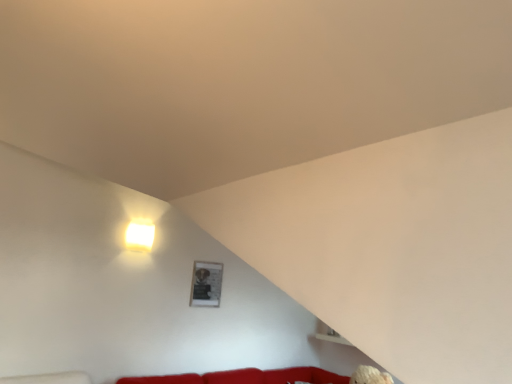
Question: Is white glossy square at upper left in front of matte black picture frame at upper center?

Choices:
 (A) yes
 (B) no

Answer: (A)

Question: Is matte black picture frame at upper center surrounded by white glossy square at upper left?

Choices:
 (A) yes
 (B) no

Answer: (B)

Question: From the image's perspective, does white glossy square at upper left appear lower than matte black picture frame at upper center?

Choices:
 (A) no
 (B) yes

Answer: (A)

Question: Can you confirm if white glossy square at upper left is taller than matte black picture frame at upper center?

Choices:
 (A) no
 (B) yes

Answer: (A)

Question: Is white glossy square at upper left to the left of matte black picture frame at upper center from the viewer's perspective?

Choices:
 (A) no
 (B) yes

Answer: (B)

Question: From a real-world perspective, is white glossy square at upper left below matte black picture frame at upper center?

Choices:
 (A) no
 (B) yes

Answer: (A)

Question: Does matte black picture frame at upper center turn towards white glossy square at upper left?

Choices:
 (A) no
 (B) yes

Answer: (A)

Question: From the image's perspective, is matte black picture frame at upper center below white glossy square at upper left?

Choices:
 (A) no
 (B) yes

Answer: (B)

Question: Can you confirm if matte black picture frame at upper center is taller than white glossy square at upper left?

Choices:
 (A) no
 (B) yes

Answer: (B)

Question: Is matte black picture frame at upper center to the right of white glossy square at upper left from the viewer's perspective?

Choices:
 (A) no
 (B) yes

Answer: (B)

Question: Does matte black picture frame at upper center contain white glossy square at upper left?

Choices:
 (A) no
 (B) yes

Answer: (A)

Question: Can you confirm if matte black picture frame at upper center is shorter than white glossy square at upper left?

Choices:
 (A) no
 (B) yes

Answer: (A)

Question: From their relative heights in the image, would you say white glossy square at upper left is taller or shorter than matte black picture frame at upper center?

Choices:
 (A) short
 (B) tall

Answer: (A)